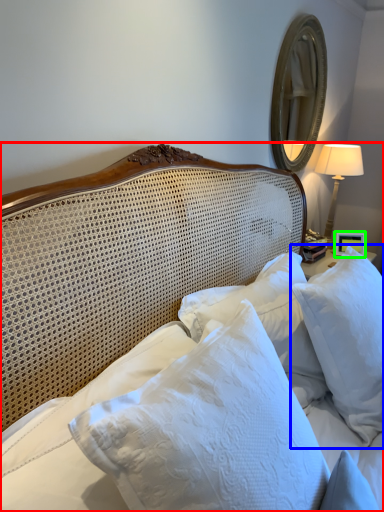
Question: Which object is the farthest from bed (highlighted by a red box)? Choose among these: pillow (highlighted by a blue box) or picture frame (highlighted by a green box).

Choices:
 (A) pillow
 (B) picture frame

Answer: (B)